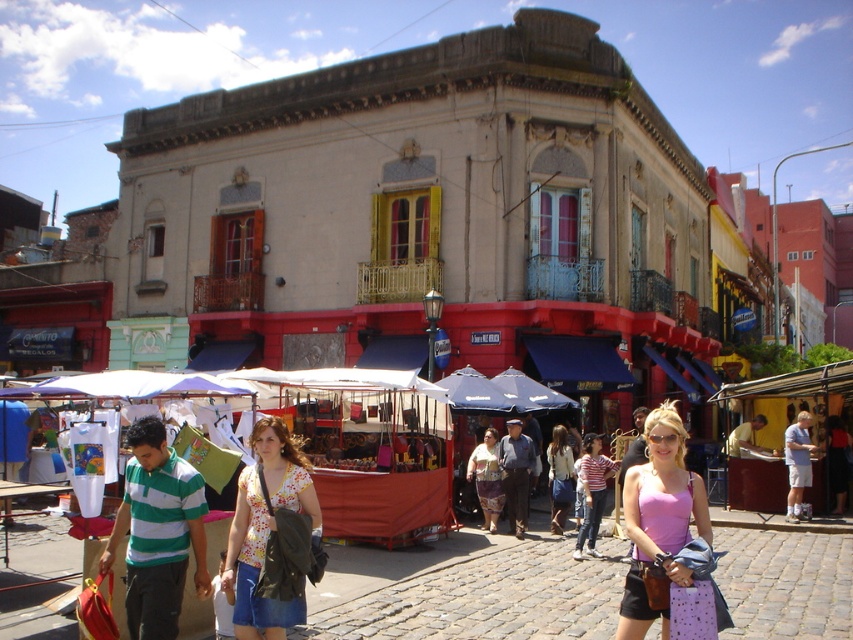
Does floral print blouse at center appear over floral fabric dress at center?

Indeed, floral print blouse at center is positioned over floral fabric dress at center.

Is point (277, 602) positioned after point (496, 512)?

No, (277, 602) is in front of (496, 512).

Does point (299, 616) come farther from viewer compared to point (498, 492)?

No, it is not.

This screenshot has height=640, width=853. I want to click on floral print blouse at center, so click(x=265, y=529).

Which of these two, pink fabric tank top at center or floral fabric dress at center, stands shorter?

floral fabric dress at center

Does pink fabric tank top at center appear under floral fabric dress at center?

No.

This screenshot has width=853, height=640. Describe the element at coordinates (659, 518) in the screenshot. I see `pink fabric tank top at center` at that location.

Image resolution: width=853 pixels, height=640 pixels. In order to click on pink fabric tank top at center in this screenshot , I will do `click(659, 518)`.

Which of these two, floral fabric dress at center or denim skirt at center, stands taller?

denim skirt at center

Is floral fabric dress at center smaller than denim skirt at center?

Correct, floral fabric dress at center occupies less space than denim skirt at center.

Is point (490, 525) closer to camera compared to point (553, 461)?

Yes, it is in front of point (553, 461).

At what (x,y) coordinates should I click in order to perform the action: click on floral fabric dress at center. Please return your answer as a coordinate pair (x, y). The image size is (853, 640). Looking at the image, I should click on (486, 480).